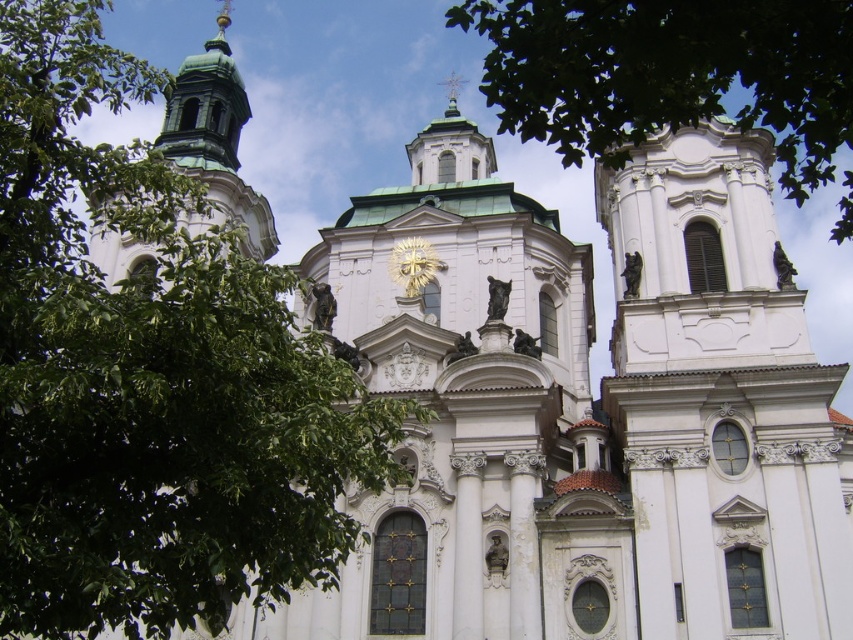
You are standing in front of the church and want to take a photo of both the white marble tower at right and the gold metallic clock at center. Which object should you adjust your camera focus on first to ensure both are in the frame?

Since the white marble tower at right is closer to the viewer than the gold metallic clock at center, you should focus on the white marble tower at right first to ensure both are in focus.

You are standing in front of the grand Baroque church. You notice a point at coordinate (149, 376). What object is located at that point?

The point at coordinate (149, 376) corresponds to the green leafy tree at upper left.

You are standing at the entrance of the grand Baroque church and want to locate the white marble tower at right. According to the coordinates provided, where should you look to find it?

The white marble tower at right is located at coordinates point (721, 397), so you should look to the right side of the church facade, slightly lower than the top edge.